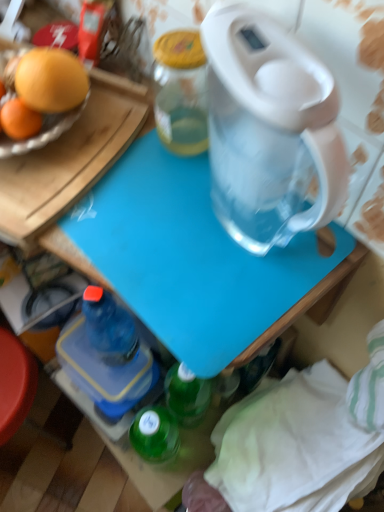
Identify the location of vacant space that is to the left of blue plastic cutting board at center. (119, 240).